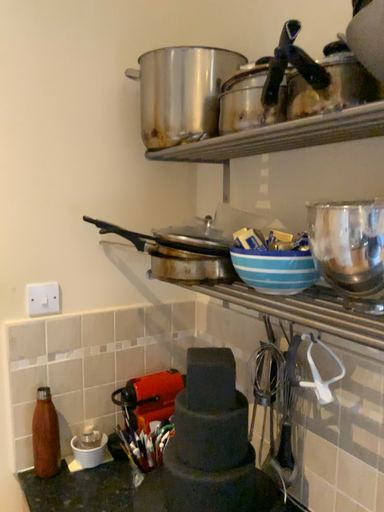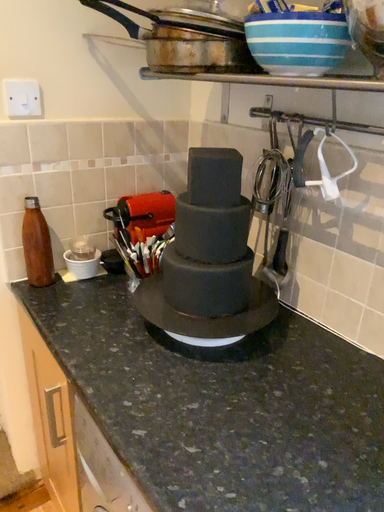
Question: How did the camera likely rotate when shooting the video?

Choices:
 (A) rotated upward
 (B) rotated downward

Answer: (B)